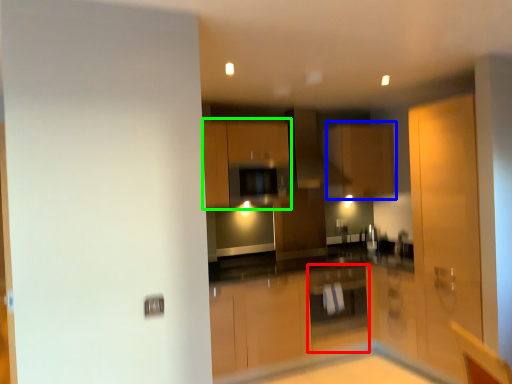
Question: Estimate the real-world distances between objects in this image. Which object is closer to cabinetry (highlighted by a red box), cabinetry (highlighted by a blue box) or cabinetry (highlighted by a green box)?

Choices:
 (A) cabinetry
 (B) cabinetry

Answer: (A)